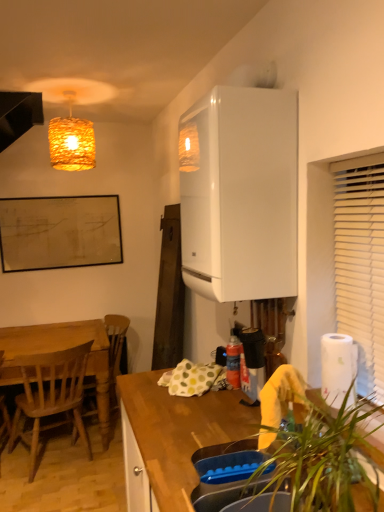
Question: Would you say woven straw lampshade at upper left is inside or outside wooden at lower right?

Choices:
 (A) outside
 (B) inside

Answer: (A)

Question: From the image's perspective, relative to wooden at lower right, is woven straw lampshade at upper left above or below?

Choices:
 (A) below
 (B) above

Answer: (B)

Question: Which is farther from the wooden at lower right?

Choices:
 (A) wooden chair at left, which is the 1th chair from front to back
 (B) wooden chair at left, the second chair in the front-to-back sequence
 (C) white glossy boiler at upper right
 (D) black matte exhaust hood at upper left
 (E) white paper at right

Answer: (D)

Question: Estimate the real-world distances between objects in this image. Which object is closer to the white glossy boiler at upper right?

Choices:
 (A) black matte exhaust hood at upper left
 (B) wooden at lower right
 (C) white paper at right
 (D) wooden chair at left, which is the 1th chair from front to back
 (E) wooden chair at left, the second chair in the front-to-back sequence

Answer: (C)